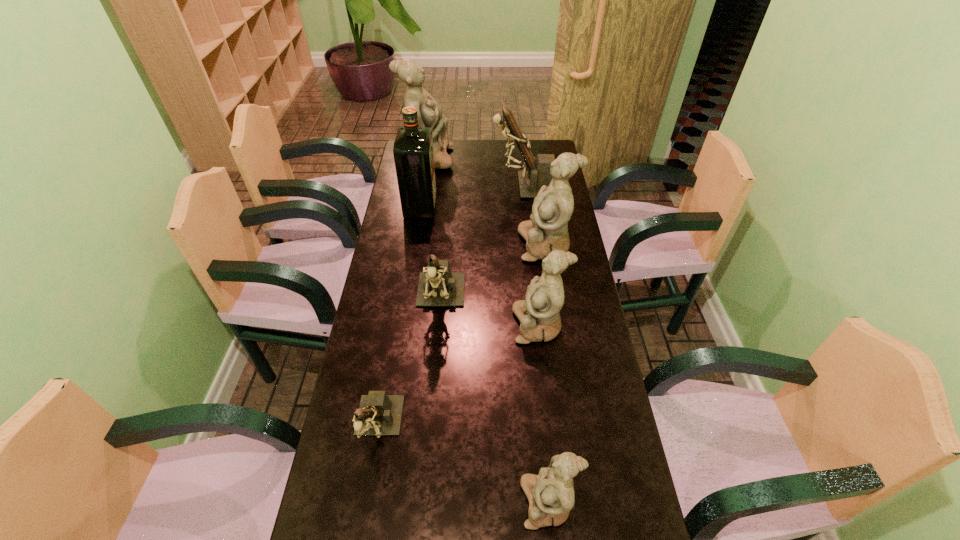
Identify the location of object that is at the far left corner. (429, 112).

Identify the location of vacant area at the far edge. The width and height of the screenshot is (960, 540). (451, 140).

I want to click on vacant space at the left edge of the desktop, so click(x=382, y=484).

This screenshot has width=960, height=540. Identify the location of vacant space at the right edge of the desktop. (577, 314).

This screenshot has width=960, height=540. I want to click on free space between the nearest object and the rightmost brown figurine, so click(x=537, y=344).

Locate an element on the screen. vacant area that lies between the second nearest white figurine and the biggest white figurine is located at coordinates (483, 242).

Identify the location of free space between the second smallest brown figurine and the liquor. (430, 253).

Find the location of `free space between the second nearest brown figurine and the third farthest white figurine`. free space between the second nearest brown figurine and the third farthest white figurine is located at coordinates (490, 313).

Find the location of a particular element. The image size is (960, 540). object that stands as the fifth closest to the sixth nearest figurine is located at coordinates (539, 316).

Find the location of a particular element. The height and width of the screenshot is (540, 960). the third closest object to the seventh farthest object is located at coordinates (539, 316).